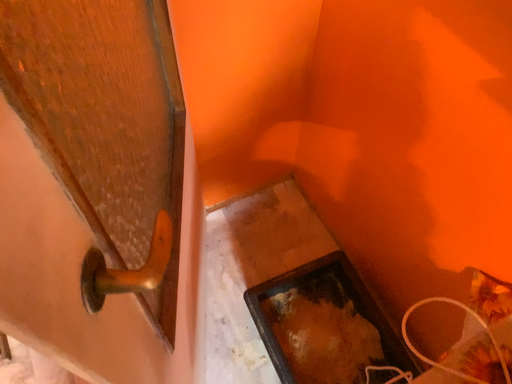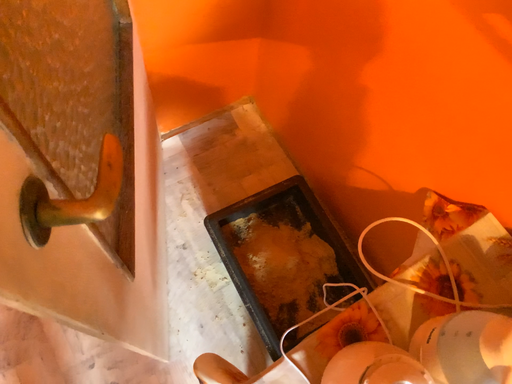
Question: Which way did the camera rotate in the video?

Choices:
 (A) rotated downward
 (B) rotated upward

Answer: (A)